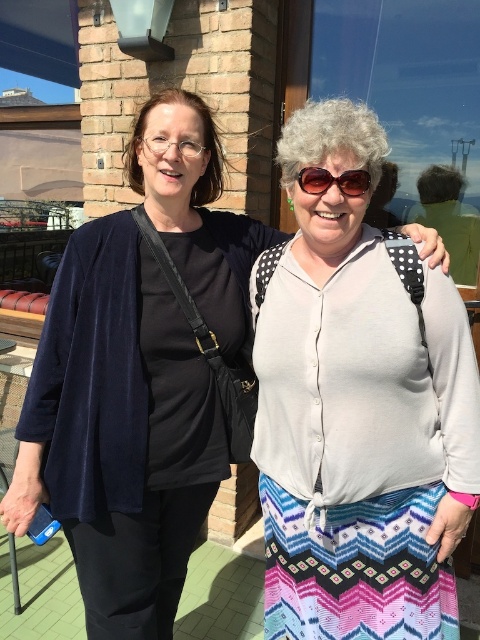
Measure the distance from white textured blouse at center to brown plastic sunglasses at center.

white textured blouse at center is 20.23 inches away from brown plastic sunglasses at center.

Does white textured blouse at center appear on the right side of brown plastic sunglasses at center?

Correct, you'll find white textured blouse at center to the right of brown plastic sunglasses at center.

Is point (292, 436) positioned in front of point (336, 179)?

No, (292, 436) is behind (336, 179).

Locate an element on the screen. The image size is (480, 640). white textured blouse at center is located at coordinates (358, 408).